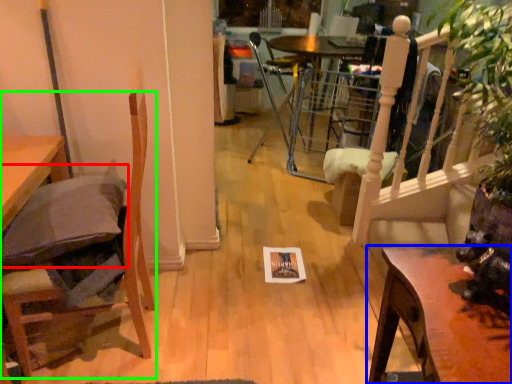
Question: Considering the real-world distances, which object is closest to pillow (highlighted by a red box)? table (highlighted by a blue box) or chair (highlighted by a green box).

Choices:
 (A) table
 (B) chair

Answer: (B)